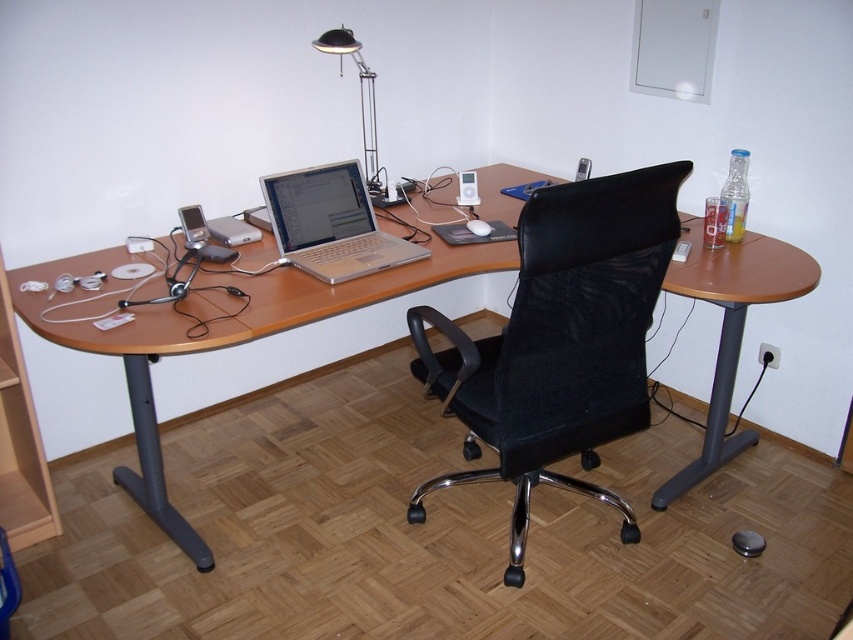
Question: Among these points, which one is farthest from the camera?

Choices:
 (A) (384, 236)
 (B) (485, 432)

Answer: (A)

Question: Which object is positioned farthest from the black mesh swivel chair at center?

Choices:
 (A) woodendesk at center
 (B) metallic silver desk lamp at upper center

Answer: (B)

Question: Is black mesh swivel chair at center in front of metallic silver desk lamp at upper center?

Choices:
 (A) yes
 (B) no

Answer: (A)

Question: Does woodendesk at center appear over metallic silver desk lamp at upper center?

Choices:
 (A) no
 (B) yes

Answer: (A)

Question: Which object is closer to the camera taking this photo?

Choices:
 (A) black mesh swivel chair at center
 (B) metallic silver desk lamp at upper center
 (C) silver metallic laptop at center

Answer: (A)

Question: Where is woodendesk at center located in relation to silver metallic laptop at center in the image?

Choices:
 (A) below
 (B) above

Answer: (A)